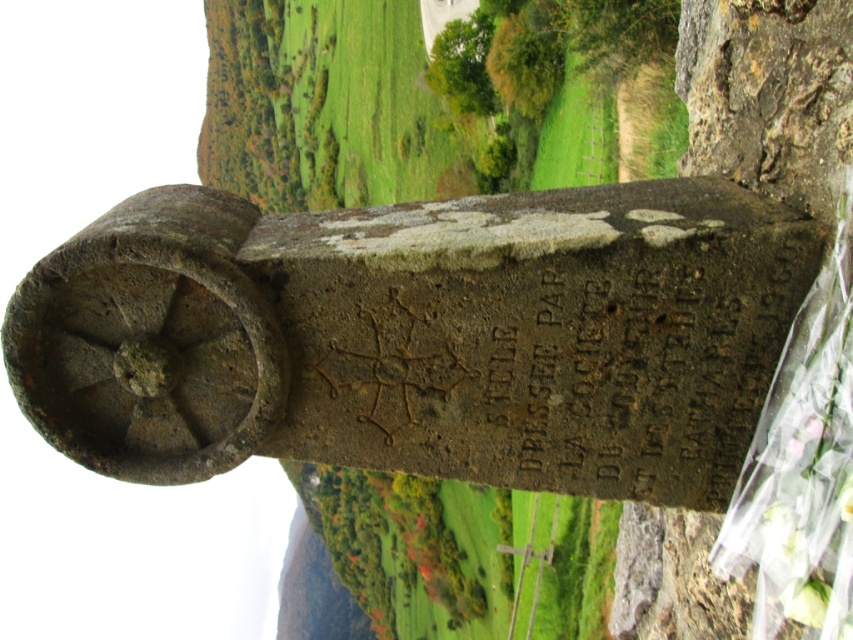
Which is in front, point (183, 228) or point (660, 618)?

Positioned in front is point (183, 228).

Does rusty stone gravestone at center have a greater width compared to smooth brown stone at right?

Yes, rusty stone gravestone at center is wider than smooth brown stone at right.

Describe the element at coordinates (421, 337) in the screenshot. I see `rusty stone gravestone at center` at that location.

The width and height of the screenshot is (853, 640). In order to click on rusty stone gravestone at center in this screenshot , I will do `click(421, 337)`.